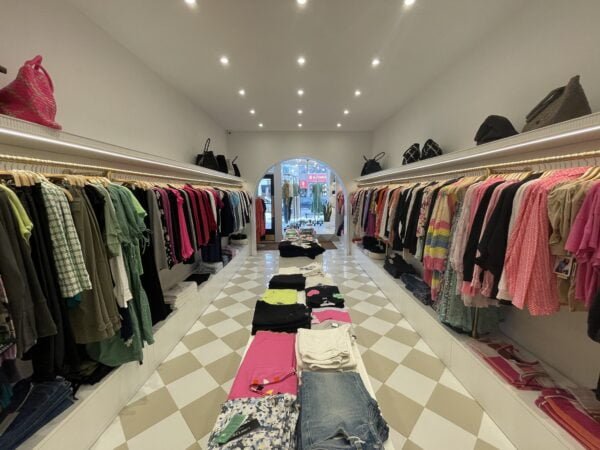
This screenshot has width=600, height=450. In order to click on right wall in this screenshot , I will do `click(451, 115)`.